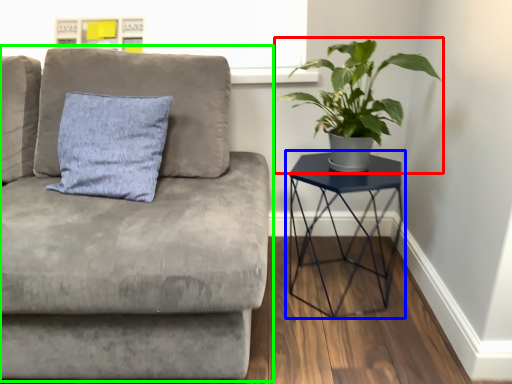
Question: Which object is the farthest from houseplant (highlighted by a red box)? Choose among these: table (highlighted by a blue box) or studio couch (highlighted by a green box).

Choices:
 (A) table
 (B) studio couch

Answer: (B)